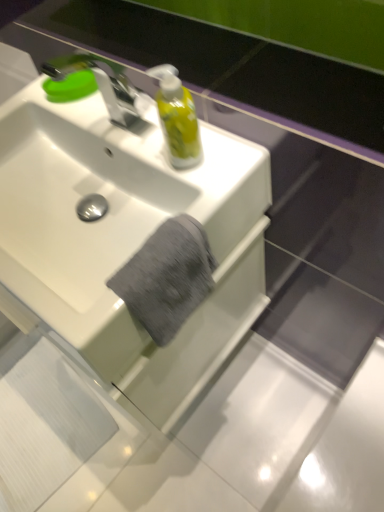
What is the approximate height of translucent yellow liquid at upper center?

The height of translucent yellow liquid at upper center is 6.15 inches.

Where is `white glossy sink at center`? The width and height of the screenshot is (384, 512). white glossy sink at center is located at coordinates (108, 212).

Identify the location of translucent yellow liquid at upper center. Image resolution: width=384 pixels, height=512 pixels. (177, 117).

Does white glossy sink at center have a smaller size compared to gray cotton towel at center?

No.

Consider the image. Is white glossy sink at center looking in the opposite direction of gray cotton towel at center?

No, white glossy sink at center is not facing away from gray cotton towel at center.

Would you say gray cotton towel at center is part of white glossy sink at center's contents?

Yes, gray cotton towel at center can be found within white glossy sink at center.

From the picture: From the image's perspective, is white glossy sink at center below gray cotton towel at center?

No, from the image's perspective, white glossy sink at center is not below gray cotton towel at center.

Does translucent yellow liquid at upper center have a larger size compared to silver metallic faucet at upper left?

Incorrect, translucent yellow liquid at upper center is not larger than silver metallic faucet at upper left.

Is translucent yellow liquid at upper center placed right next to silver metallic faucet at upper left?

translucent yellow liquid at upper center and silver metallic faucet at upper left are not in contact.

Do you think translucent yellow liquid at upper center is within silver metallic faucet at upper left, or outside of it?

translucent yellow liquid at upper center lies outside silver metallic faucet at upper left.

Can you confirm if translucent yellow liquid at upper center is positioned to the left of silver metallic faucet at upper left?

No, translucent yellow liquid at upper center is not to the left of silver metallic faucet at upper left.

Is translucent yellow liquid at upper center outside of green matte soap at upper left?

Yes, translucent yellow liquid at upper center is not within green matte soap at upper left.

In terms of height, does translucent yellow liquid at upper center look taller or shorter compared to green matte soap at upper left?

Considering their sizes, translucent yellow liquid at upper center has more height than green matte soap at upper left.

Is translucent yellow liquid at upper center smaller than green matte soap at upper left?

Actually, translucent yellow liquid at upper center might be larger than green matte soap at upper left.

Is white glossy sink at center positioned with its back to silver metallic faucet at upper left?

No.

Which object is wider, white glossy sink at center or silver metallic faucet at upper left?

white glossy sink at center.

Which is behind, point (127, 221) or point (63, 64)?

Positioned behind is point (63, 64).

From a real-world perspective, is silver metallic faucet at upper left physically located above or below gray cotton towel at center?

In terms of real-world spatial position, silver metallic faucet at upper left is above gray cotton towel at center.

From the image's perspective, is silver metallic faucet at upper left above gray cotton towel at center?

Yes.

Is silver metallic faucet at upper left situated inside gray cotton towel at center or outside?

The correct answer is: outside.

Which point is more forward, (51, 69) or (159, 254)?

Point (159, 254)

Is gray cotton towel at center positioned far away from silver metallic faucet at upper left?

No, gray cotton towel at center is not far from silver metallic faucet at upper left.

Which of these two, gray cotton towel at center or silver metallic faucet at upper left, stands shorter?

With less height is gray cotton towel at center.

From the image's perspective, which is above, gray cotton towel at center or silver metallic faucet at upper left?

silver metallic faucet at upper left is shown above in the image.

From the image's perspective, between silver metallic faucet at upper left and translucent yellow liquid at upper center, who is located below?

From the image's view, translucent yellow liquid at upper center is below.

Is silver metallic faucet at upper left not inside translucent yellow liquid at upper center?

Yes.

Who is bigger, silver metallic faucet at upper left or translucent yellow liquid at upper center?

→ With larger size is silver metallic faucet at upper left.

Image resolution: width=384 pixels, height=512 pixels. Identify the location of tap above the translucent yellow liquid at upper center (from a real-world perspective). (95, 85).

Locate an element on the screen. The image size is (384, 512). bath towel behind the white glossy sink at center is located at coordinates (167, 277).

At what (x,y) coordinates should I click in order to perform the action: click on mouthwash that is below the silver metallic faucet at upper left (from the image's perspective). Please return your answer as a coordinate pair (x, y). Looking at the image, I should click on coord(177,117).

From the image, which object appears to be nearer to gray cotton towel at center, silver metallic faucet at upper left or white glossy sink at center?

white glossy sink at center.

Consider the image. Which object lies further to the anchor point white glossy sink at center, silver metallic faucet at upper left or green matte soap at upper left?

green matte soap at upper left is positioned further to the anchor white glossy sink at center.

Which object lies nearer to the anchor point gray cotton towel at center, silver metallic faucet at upper left or green matte soap at upper left?

The object closer to gray cotton towel at center is silver metallic faucet at upper left.

Considering their positions, is gray cotton towel at center positioned further to silver metallic faucet at upper left than white glossy sink at center?

gray cotton towel at center is positioned further to the anchor silver metallic faucet at upper left.

Which object lies nearer to the anchor point gray cotton towel at center, green matte soap at upper left or white glossy sink at center?

white glossy sink at center is positioned closer to the anchor gray cotton towel at center.

Looking at the image, which one is located closer to green matte soap at upper left, gray cotton towel at center or translucent yellow liquid at upper center?

translucent yellow liquid at upper center.

Estimate the real-world distances between objects in this image. Which object is further from translucent yellow liquid at upper center, green matte soap at upper left or silver metallic faucet at upper left?

Based on the image, green matte soap at upper left appears to be further to translucent yellow liquid at upper center.

Based on their spatial positions, is white glossy sink at center or translucent yellow liquid at upper center closer to green matte soap at upper left?

translucent yellow liquid at upper center is closer to green matte soap at upper left.

Find the location of `tap located between white glossy sink at center and green matte soap at upper left in the depth direction`. tap located between white glossy sink at center and green matte soap at upper left in the depth direction is located at coordinates (95, 85).

In order to click on mouthwash located between white glossy sink at center and green matte soap at upper left in the depth direction in this screenshot , I will do `click(177, 117)`.

Where is `tap between green matte soap at upper left and gray cotton towel at center in the vertical direction`? The image size is (384, 512). tap between green matte soap at upper left and gray cotton towel at center in the vertical direction is located at coordinates (95, 85).

Find the location of a particular element. sink between green matte soap at upper left and gray cotton towel at center in the vertical direction is located at coordinates (108, 212).